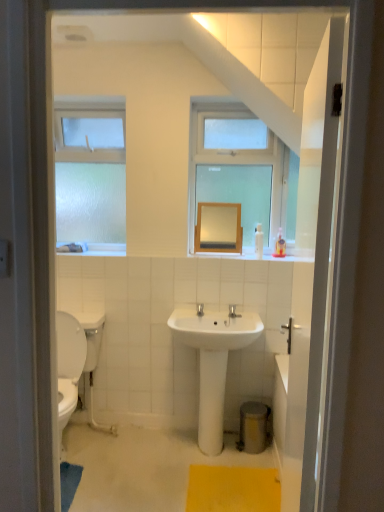
This screenshot has height=512, width=384. I want to click on vacant region to the left of white glossy sink at center, so click(x=136, y=456).